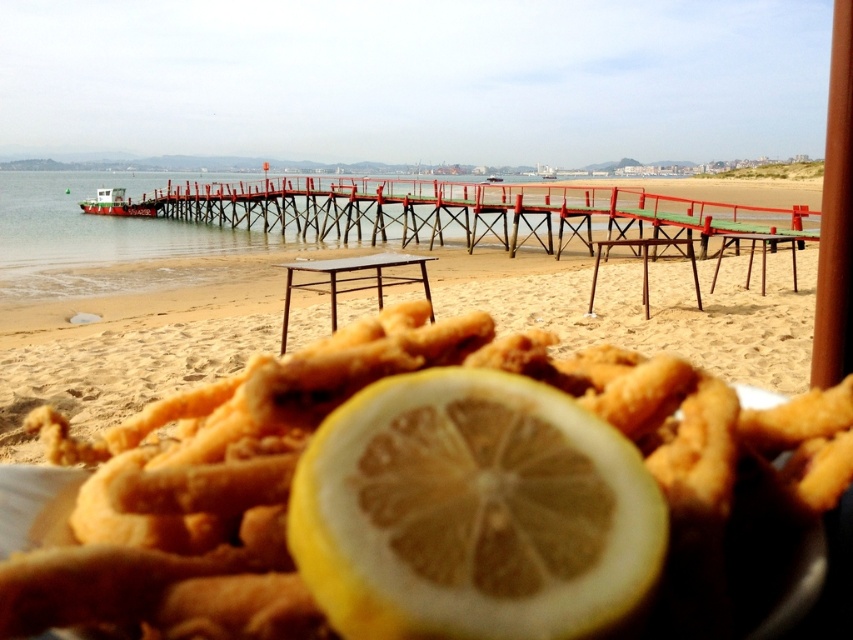
You are a food critic who needs to take a photo of the golden fried calamari at center and the small white boat with a red stripe. How far apart are these two items in the image?

The golden fried calamari at center and the small white boat with a red stripe are 23.95 centimeters apart.

Looking at this image, you are a photographer trying to capture the golden fried calamari at center and the sandy yellow at lower center in the same frame. Based on their positions, which object should you focus on first to ensure both are in the shot?

The golden fried calamari at center is located below sandy yellow at lower center, so you should focus on the sandy yellow at lower center first to ensure both are in the shot.

Looking at this image, you are a photographer standing at the edge of the beach, holding a camera. You want to capture both the yellow matte lemon at center and the sandy yellow at lower center in a single shot. Given that your camera has a maximum focal length of 5 meters, can you include both objects in the frame without moving your position?

The yellow matte lemon at center and sandy yellow at lower center are 7.13 meters apart. Since the maximum focal length of the camera is 5 meters, which is shorter than the distance between the two objects, you cannot include both in the frame without moving your position.